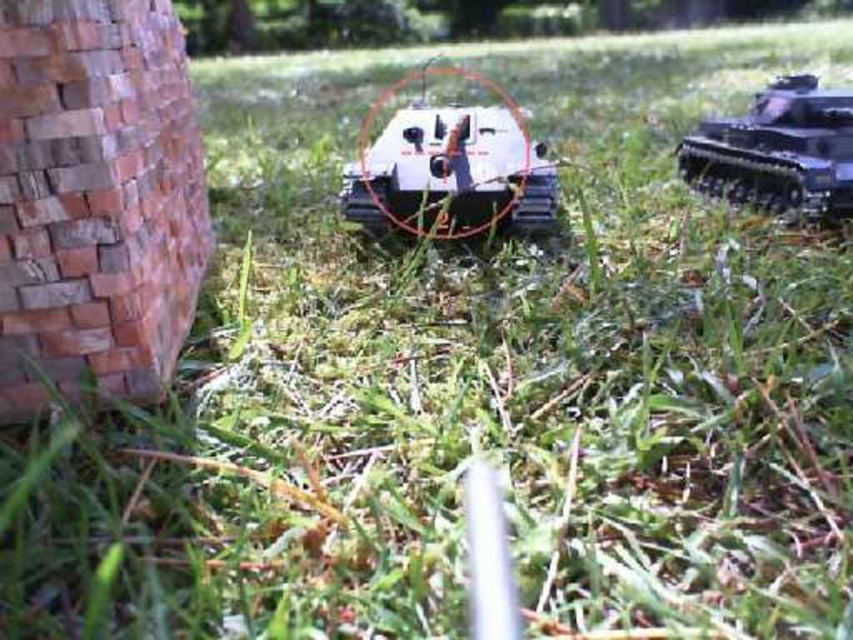
You are a child playing with two toy tanks in the grass. You want to know which tank is wider. Which one is wider between the white plastic tank at center and the shiny black tank at upper right?

The white plastic tank at center is wider than the shiny black tank at upper right.

Based on the photo, you are a child playing in the grassy area and want to move your white plastic tank at center closer to the shiny black tank at upper right. Which direction should you move it to get closer?

The white plastic tank at center is in front of the shiny black tank at upper right, so moving it backward towards the upper right direction would bring it closer to the shiny black tank at upper right.

You are a child playing with the white plastic tank at center and the shiny black tank at upper right. Which tank do you think is taller?

The shiny black tank at upper right is taller than the white plastic tank at center.